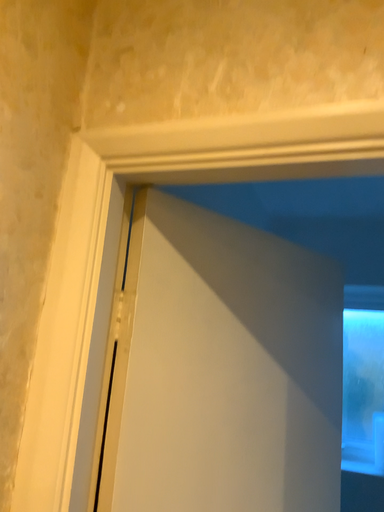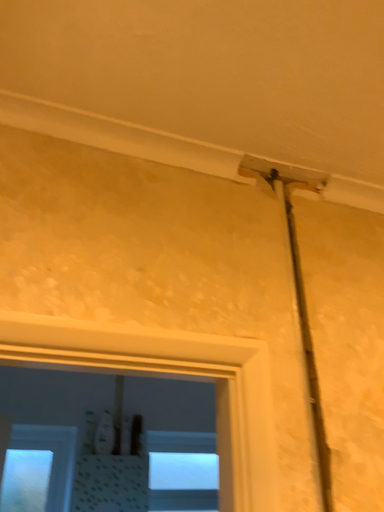
Question: How did the camera likely rotate when shooting the video?

Choices:
 (A) rotated left
 (B) rotated right

Answer: (B)